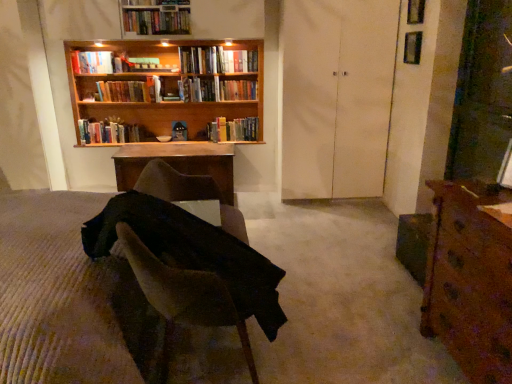
Question: Is wooden bookshelf at upper center looking in the opposite direction of brown fabric chair at center?

Choices:
 (A) no
 (B) yes

Answer: (A)

Question: Can you confirm if wooden bookshelf at upper center is bigger than brown fabric chair at center?

Choices:
 (A) no
 (B) yes

Answer: (A)

Question: Would you say wooden bookshelf at upper center is a long distance from brown fabric chair at center?

Choices:
 (A) yes
 (B) no

Answer: (A)

Question: Is wooden bookshelf at upper center taller than brown fabric chair at center?

Choices:
 (A) no
 (B) yes

Answer: (B)

Question: Are wooden bookshelf at upper center and brown fabric chair at center making contact?

Choices:
 (A) yes
 (B) no

Answer: (B)

Question: Does point (300, 48) appear closer or farther from the camera than point (131, 14)?

Choices:
 (A) farther
 (B) closer

Answer: (A)

Question: Considering the positions of white matte door at center and hardcover books at upper center, which appears as the 7th book when ordered from the bottom, in the image, is white matte door at center wider or thinner than hardcover books at upper center, which appears as the 7th book when ordered from the bottom,?

Choices:
 (A) thin
 (B) wide

Answer: (B)

Question: Is white matte door at center situated inside hardcover books at upper center, the 1th book from the top, or outside?

Choices:
 (A) outside
 (B) inside

Answer: (A)

Question: In the image, is white matte door at center positioned in front of or behind hardcover books at upper center, the 1th book from the top?

Choices:
 (A) front
 (B) behind

Answer: (A)

Question: From the image's perspective, is hardcover book at upper center, which ranks as the sixth book in bottom-to-top order, located above or below hardcover books at upper left, which ranks as the sixth book in top-to-bottom order?

Choices:
 (A) below
 (B) above

Answer: (B)

Question: Based on their sizes in the image, would you say hardcover book at upper center, which ranks as the sixth book in bottom-to-top order, is bigger or smaller than hardcover books at upper left, which ranks as the sixth book in top-to-bottom order?

Choices:
 (A) small
 (B) big

Answer: (A)

Question: From a real-world perspective, is hardcover book at upper center, which ranks as the sixth book in bottom-to-top order, physically located above or below hardcover books at upper left, which ranks as the sixth book in top-to-bottom order?

Choices:
 (A) above
 (B) below

Answer: (A)

Question: Is point (237, 59) positioned closer to the camera than point (110, 94)?

Choices:
 (A) farther
 (B) closer

Answer: (B)

Question: Considering the positions of wooden bookshelf at upper center and hardcover books at center, which ranks as the 5th book in bottom-to-top order, in the image, is wooden bookshelf at upper center bigger or smaller than hardcover books at center, which ranks as the 5th book in bottom-to-top order,?

Choices:
 (A) small
 (B) big

Answer: (B)

Question: Is wooden bookshelf at upper center to the left or to the right of hardcover books at center, which ranks as the 5th book in bottom-to-top order, in the image?

Choices:
 (A) left
 (B) right

Answer: (A)